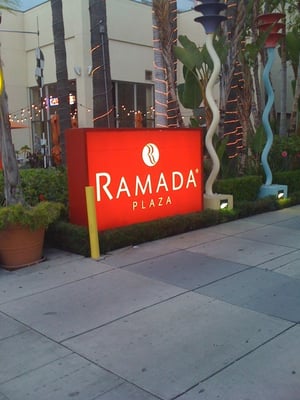
Where is `light fixtures`? light fixtures is located at coordinates (268, 185), (211, 202).